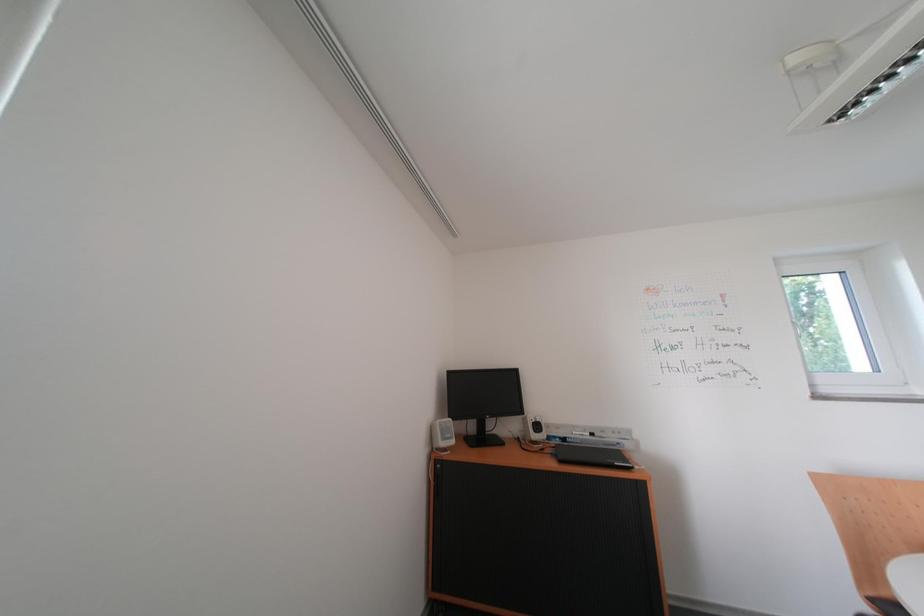
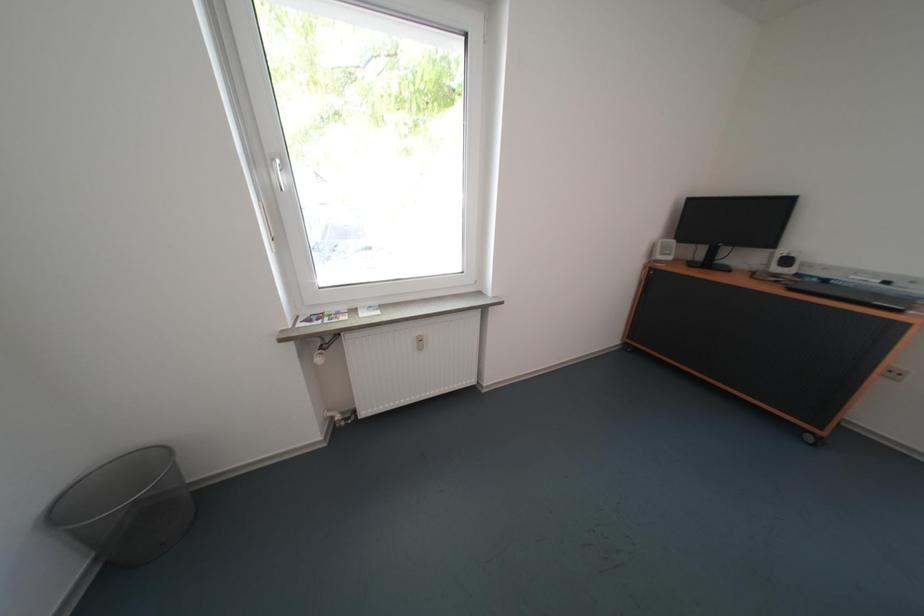
The images are taken continuously from a first-person perspective. In which direction is your viewpoint rotating?

The camera rotated toward left-down.